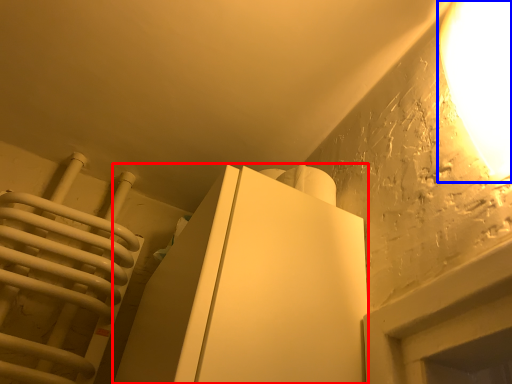
Question: Which object appears closest to the camera in this image, furniture (highlighted by a red box) or lamp (highlighted by a blue box)?

Choices:
 (A) furniture
 (B) lamp

Answer: (B)